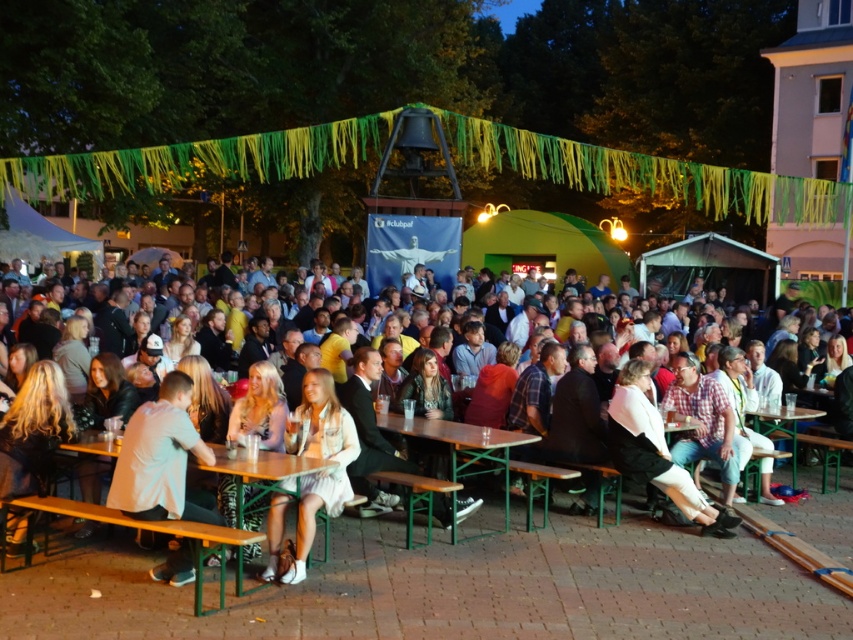
Question: Which point is closer to the camera?

Choices:
 (A) (757, 428)
 (B) (442, 428)
 (C) (354, 452)
 (D) (773, 452)

Answer: (C)

Question: Can you confirm if white cotton dress at center is bigger than wooden table at center?

Choices:
 (A) no
 (B) yes

Answer: (A)

Question: Which object is closer to the camera taking this photo?

Choices:
 (A) white cotton shirt at lower left
 (B) green metal table at lower left
 (C) white cotton dress at center

Answer: (A)

Question: Does white cotton shirt at lower left appear on the right side of green metal table at lower left?

Choices:
 (A) yes
 (B) no

Answer: (B)

Question: Which object is the farthest from the green metal table at lower left?

Choices:
 (A) green wooden table at center
 (B) white leather shoes at center
 (C) wooden table at center
 (D) light brown wooden bench at center

Answer: (A)

Question: Observing the image, what is the correct spatial positioning of white cotton dress at center in reference to green metal table at lower left?

Choices:
 (A) left
 (B) right

Answer: (B)